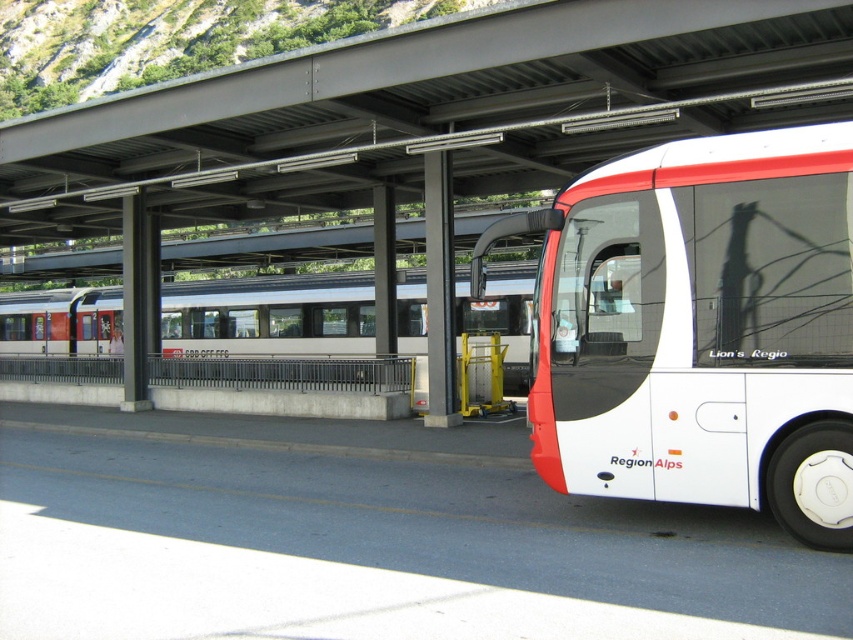
Between white matte bus at right and silver metallic train at center, which one appears on the right side from the viewer's perspective?

Positioned to the right is white matte bus at right.

Which is behind, point (759, 284) or point (36, 320)?

Point (36, 320)

Image resolution: width=853 pixels, height=640 pixels. In order to click on white matte bus at right in this screenshot , I will do `click(704, 330)`.